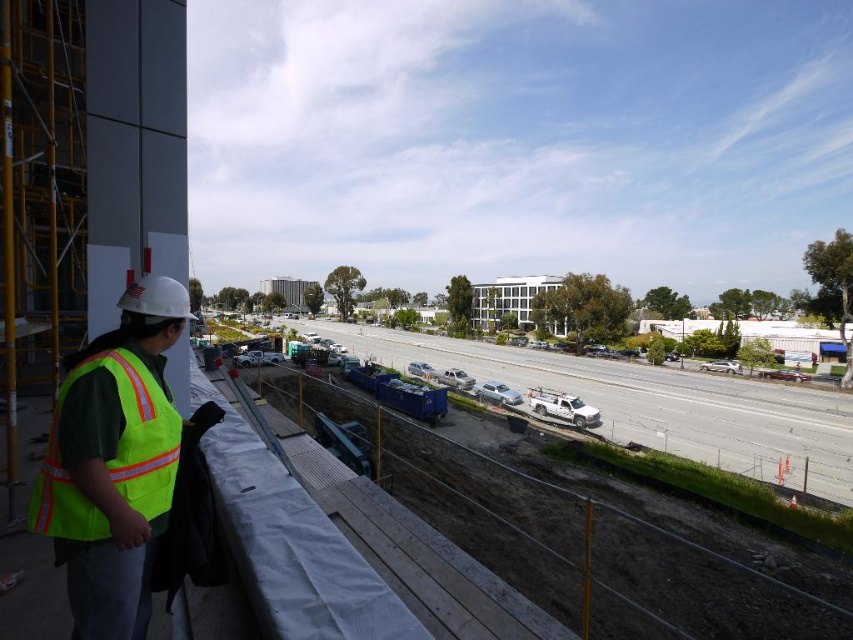
You are a construction worker standing at the edge of the construction site. You notice two points marked on the ground at coordinates point (x=96, y=595) and point (x=144, y=438). Which point is closer to your current position?

Point (x=96, y=595) is closer to the camera than point (x=144, y=438), so the point closer to your current position is point (x=96, y=595).

You are a safety inspector at the construction site. You notice a point marked at coordinates (113,461). Where is this point located on the safety vest?

The point at coordinates (113,461) is located on the high visibility reflective vest at left, specifically on the reflective stripes area.